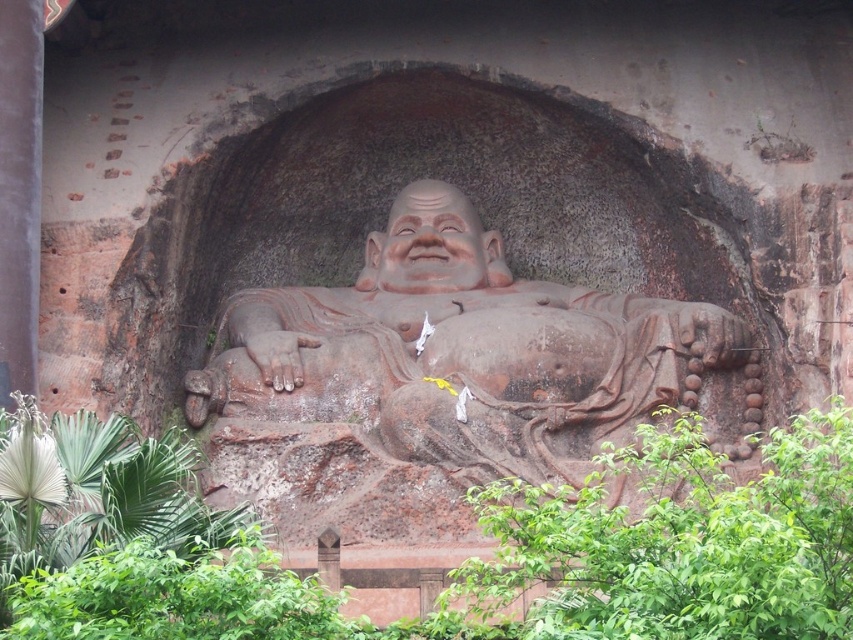
From the picture: Can you confirm if green leafy plant at lower center is wider than brown stone statue at center?

Yes, green leafy plant at lower center is wider than brown stone statue at center.

Is the position of green leafy plant at lower center less distant than that of brown stone statue at center?

Yes, it is in front of brown stone statue at center.

Which is in front, point (318, 598) or point (515, 353)?

Point (318, 598) is in front.

At what (x,y) coordinates should I click in order to perform the action: click on green leafy plant at lower center. Please return your answer as a coordinate pair (x, y). This screenshot has width=853, height=640. Looking at the image, I should click on (538, 561).

Between green leafy plant at lower center and matte clay face at center, which one has less height?

matte clay face at center

Identify the location of green leafy plant at lower center. (538, 561).

Between point (682, 538) and point (410, 266), which one is positioned behind?

The point (410, 266) is behind.

Locate an element on the screen. green leafy plant at lower center is located at coordinates (538, 561).

Can you confirm if brown stone statue at center is smaller than matte clay face at center?

No, brown stone statue at center is not smaller than matte clay face at center.

Is brown stone statue at center wider than matte clay face at center?

Correct, the width of brown stone statue at center exceeds that of matte clay face at center.

I want to click on brown stone statue at center, so click(x=460, y=352).

Find the location of a particular element. This screenshot has width=853, height=640. brown stone statue at center is located at coordinates (460, 352).